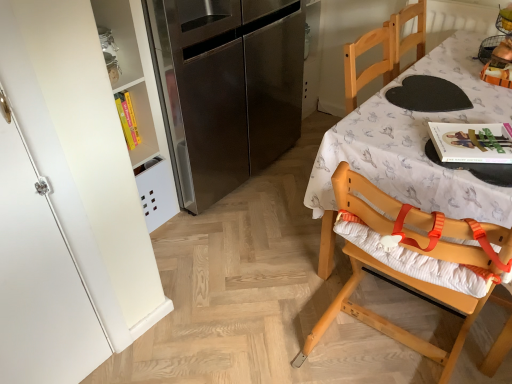
Question: Is white matte cabinet at left completely or partially outside of wooden highchair at right?

Choices:
 (A) yes
 (B) no

Answer: (A)

Question: Could you tell me if white matte cabinet at left is facing wooden highchair at right?

Choices:
 (A) no
 (B) yes

Answer: (A)

Question: Can you confirm if white matte cabinet at left is smaller than wooden highchair at right?

Choices:
 (A) yes
 (B) no

Answer: (A)

Question: From the image's perspective, would you say white matte cabinet at left is positioned over wooden highchair at right?

Choices:
 (A) yes
 (B) no

Answer: (B)

Question: Is white matte cabinet at left shorter than wooden highchair at right?

Choices:
 (A) no
 (B) yes

Answer: (A)

Question: Is stainless steel refrigerator at left bigger or smaller than wooden chair at right?

Choices:
 (A) small
 (B) big

Answer: (B)

Question: Considering the relative positions of stainless steel refrigerator at left and wooden chair at right in the image provided, is stainless steel refrigerator at left to the left or to the right of wooden chair at right?

Choices:
 (A) right
 (B) left

Answer: (B)

Question: Is stainless steel refrigerator at left spatially inside wooden chair at right, or outside of it?

Choices:
 (A) outside
 (B) inside

Answer: (A)

Question: From the image's perspective, relative to wooden chair at right, is stainless steel refrigerator at left above or below?

Choices:
 (A) below
 (B) above

Answer: (B)

Question: Is point (184, 29) positioned closer to the camera than point (114, 135)?

Choices:
 (A) closer
 (B) farther

Answer: (B)

Question: In the image, is stainless steel refrigerator at left positioned in front of or behind white matte cabinet at left?

Choices:
 (A) behind
 (B) front

Answer: (A)

Question: In the image, is stainless steel refrigerator at left on the left side or the right side of white matte cabinet at left?

Choices:
 (A) left
 (B) right

Answer: (B)

Question: In terms of size, does stainless steel refrigerator at left appear bigger or smaller than white matte cabinet at left?

Choices:
 (A) big
 (B) small

Answer: (A)

Question: Considering the positions of point (457, 218) and point (109, 253), is point (457, 218) closer or farther from the camera than point (109, 253)?

Choices:
 (A) farther
 (B) closer

Answer: (B)

Question: Is wooden chair at right wider or thinner than white matte cabinet at left?

Choices:
 (A) thin
 (B) wide

Answer: (B)